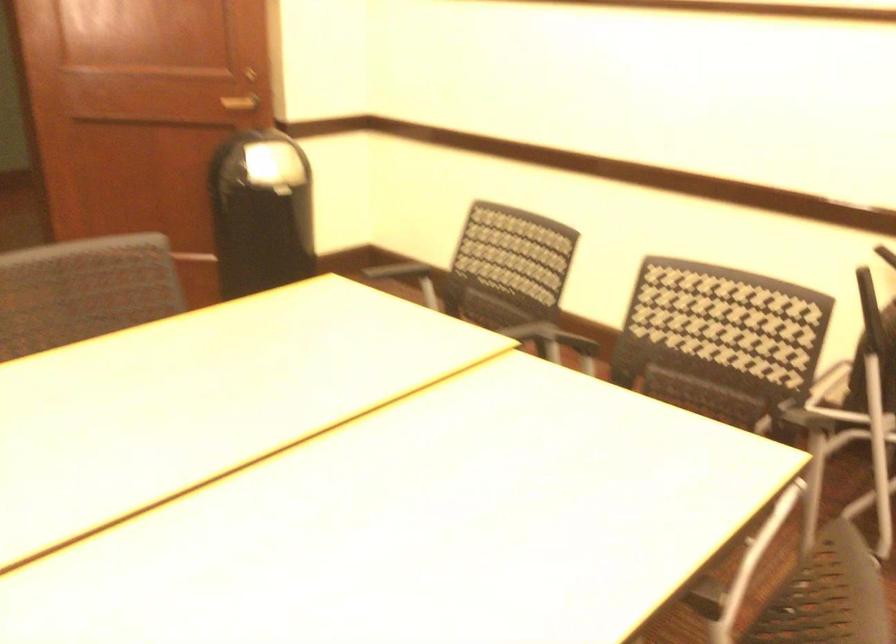
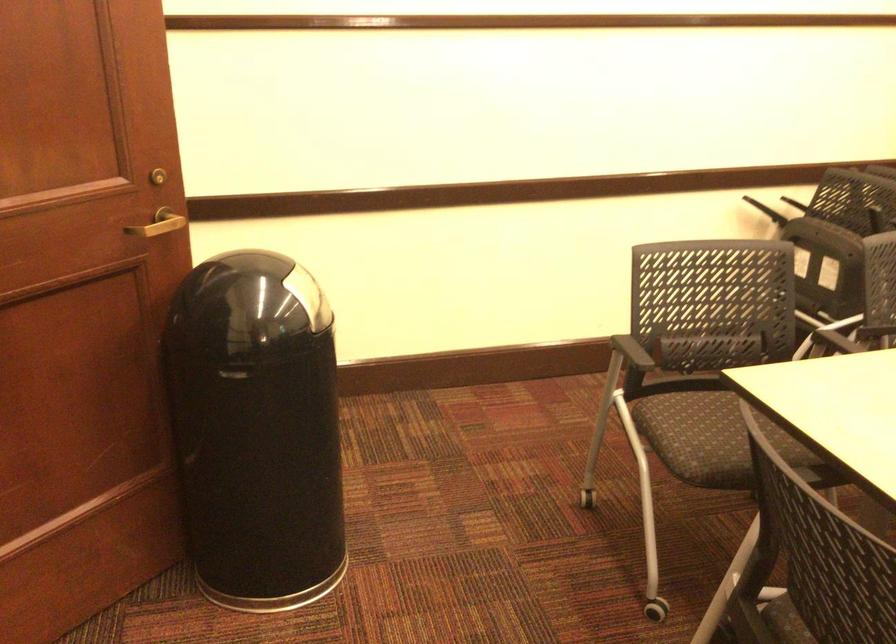
The point at [228,78] is marked in the first image. Where is the corresponding point in the second image?

(158, 223)